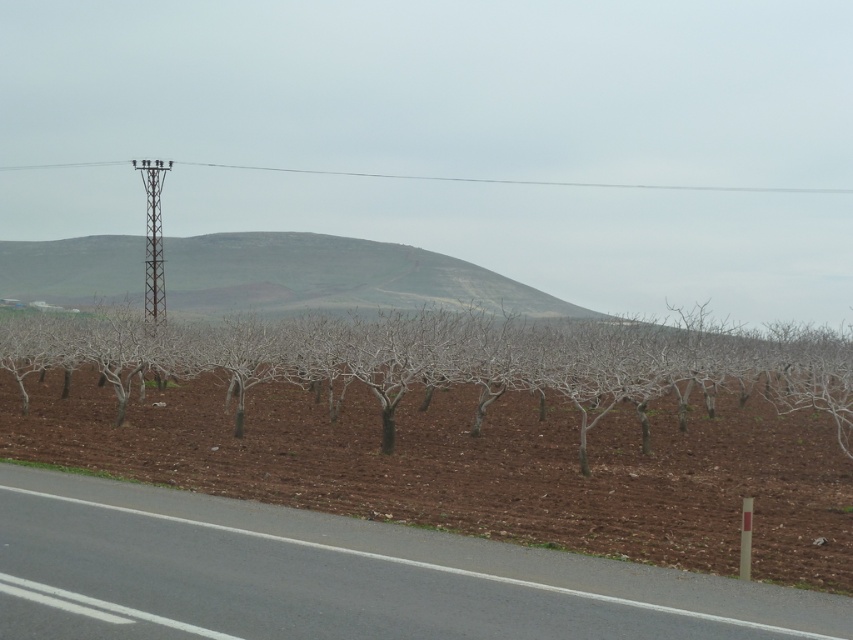
Is bare branches at center to the right of metallic wire at upper center from the viewer's perspective?

No, bare branches at center is not to the right of metallic wire at upper center.

Is bare branches at center wider than metallic wire at upper center?

No.

Locate an element on the screen. bare branches at center is located at coordinates coord(444,364).

Does bare branches at center have a lesser height compared to gray textured hillside at center?

Yes.

Based on the photo, between bare branches at center and gray textured hillside at center, which one is positioned higher?

gray textured hillside at center is above.

Between point (485, 324) and point (137, 276), which one is positioned behind?

Positioned behind is point (137, 276).

The width and height of the screenshot is (853, 640). What are the coordinates of `bare branches at center` in the screenshot? It's located at (444, 364).

Does gray textured hillside at center have a greater width compared to metallic wire at upper center?

Incorrect, gray textured hillside at center's width does not surpass metallic wire at upper center's.

Which is behind, point (271, 304) or point (552, 186)?

The point (552, 186) is behind.

Which is in front, point (381, 252) or point (364, 177)?

Point (381, 252) is more forward.

Where is `gray textured hillside at center`? This screenshot has width=853, height=640. gray textured hillside at center is located at coordinates (334, 276).